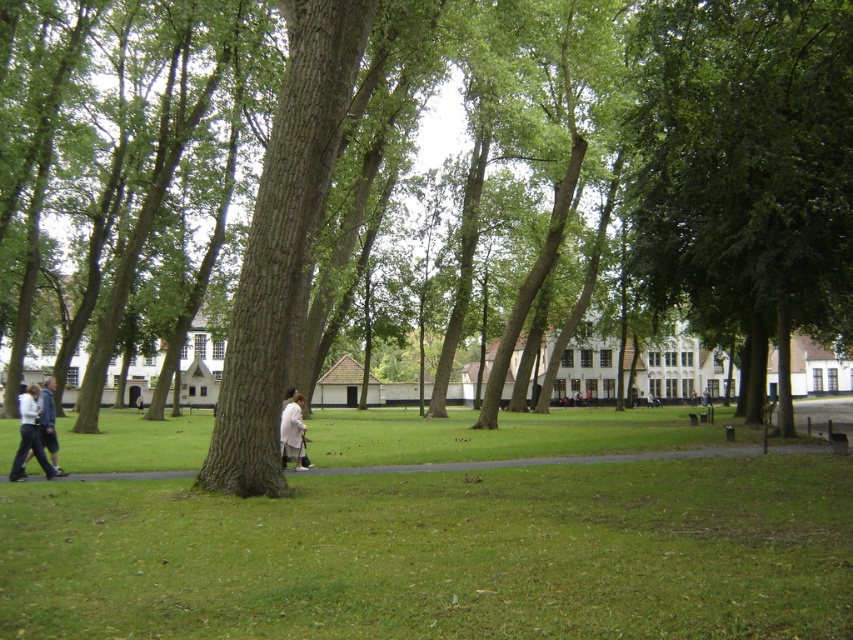
Question: Can you confirm if green rough bark tree at center is positioned to the right of white cotton jacket at lower left?

Choices:
 (A) yes
 (B) no

Answer: (A)

Question: Among these objects, which one is farthest from the camera?

Choices:
 (A) light beige fabric coat at center
 (B) green grass at lower center
 (C) green rough bark tree at center
 (D) green leafy tree at center

Answer: (A)

Question: Does green grass at lower center appear on the left side of white cotton jacket at lower left?

Choices:
 (A) yes
 (B) no

Answer: (B)

Question: Estimate the real-world distances between objects in this image. Which object is farther from the green leafy tree at center?

Choices:
 (A) white cotton jacket at lower left
 (B) green rough bark tree at center
 (C) green grass at lower center
 (D) light beige fabric coat at center

Answer: (A)

Question: Which of the following is the farthest from the observer?

Choices:
 (A) light beige fabric coat at center
 (B) white cotton jacket at lower left
 (C) green leafy tree at center

Answer: (A)

Question: In this image, where is green rough bark tree at center located relative to green leafy tree at center?

Choices:
 (A) right
 (B) left

Answer: (B)